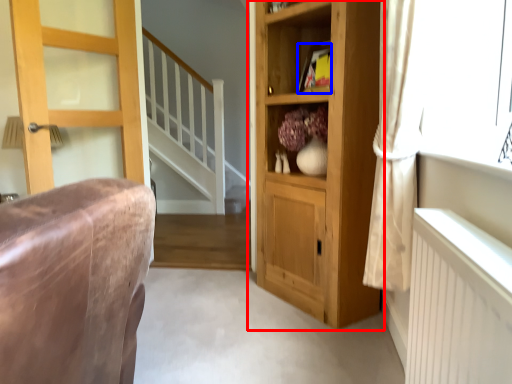
Question: Which object is further to the camera taking this photo, cupboard (highlighted by a red box) or book (highlighted by a blue box)?

Choices:
 (A) cupboard
 (B) book

Answer: (B)